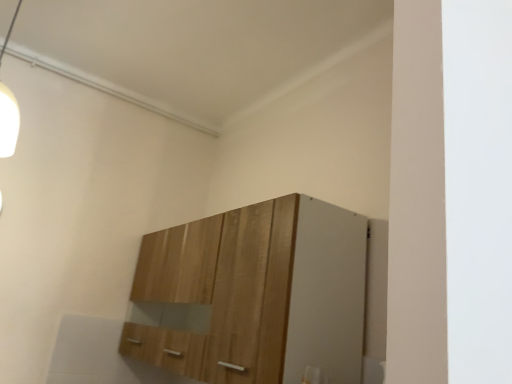
Where is `wooden cabinet at center`? This screenshot has width=512, height=384. wooden cabinet at center is located at coordinates (253, 295).

The width and height of the screenshot is (512, 384). What do you see at coordinates (253, 295) in the screenshot?
I see `wooden cabinet at center` at bounding box center [253, 295].

Locate an element on the screen. wooden cabinet at center is located at coordinates (253, 295).